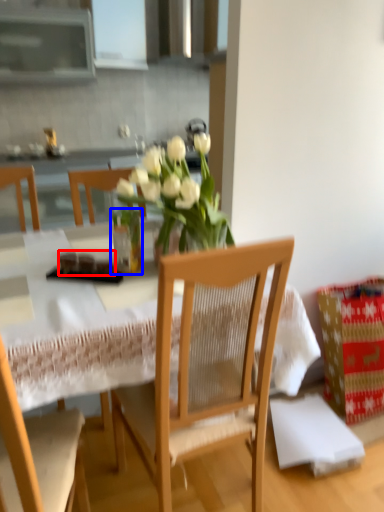
Question: Which object is closer to the camera taking this photo, food (highlighted by a red box) or glass vase (highlighted by a blue box)?

Choices:
 (A) food
 (B) glass vase

Answer: (B)